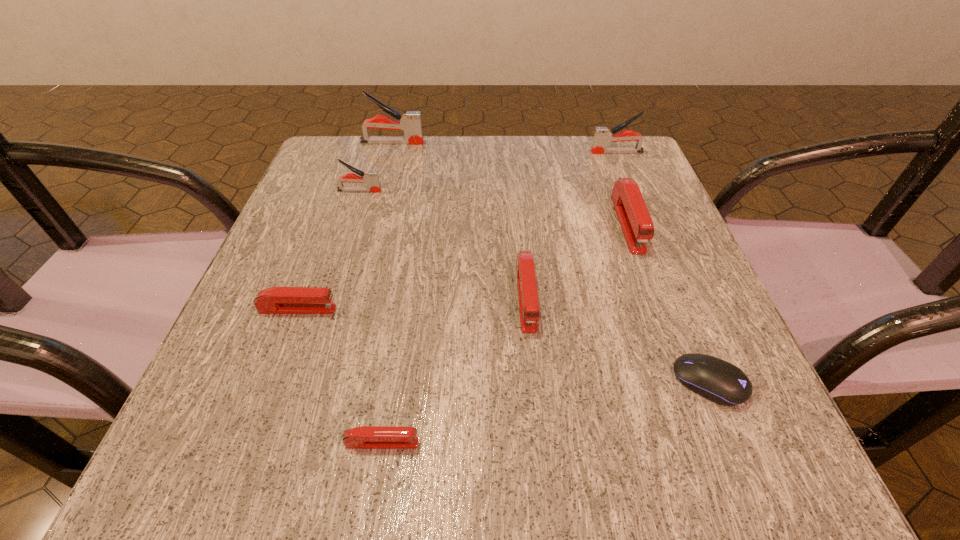
Identify the location of free space that is in between the fourth farthest object and the third farthest stapler. (493, 207).

Find the location of a particular element. The width and height of the screenshot is (960, 540). free space between the leftmost red stapler and the fourth object from right to left is located at coordinates (412, 303).

Image resolution: width=960 pixels, height=540 pixels. In order to click on blank region between the nearest red stapler and the fourth nearest stapler in this screenshot , I will do `click(505, 333)`.

The height and width of the screenshot is (540, 960). Identify the location of free space between the fifth tallest object and the sixth tallest stapler. (412, 303).

Where is `free space between the fourth farthest object and the second shortest stapler`? The image size is (960, 540). free space between the fourth farthest object and the second shortest stapler is located at coordinates (463, 266).

Find the location of a particular element. object that stands as the second closest to the shortest stapler is located at coordinates (528, 301).

Find the location of `the closest object relative to the fifth nearest stapler`. the closest object relative to the fifth nearest stapler is located at coordinates (410, 123).

Identify which stapler is located as the fourth nearest to the third shortest object. Please provide its 2D coordinates. Your answer should be formatted as a tuple, i.e. [(x, y)], where the tuple contains the x and y coordinates of a point satisfying the conditions above.

[(410, 123)]

Find the location of `the fourth closest stapler relative to the smallest red stapler`. the fourth closest stapler relative to the smallest red stapler is located at coordinates [x=371, y=178].

Select which gray stapler appears as the third closest to the biggest red stapler. Please provide its 2D coordinates. Your answer should be formatted as a tuple, i.e. [(x, y)], where the tuple contains the x and y coordinates of a point satisfying the conditions above.

[(371, 178)]